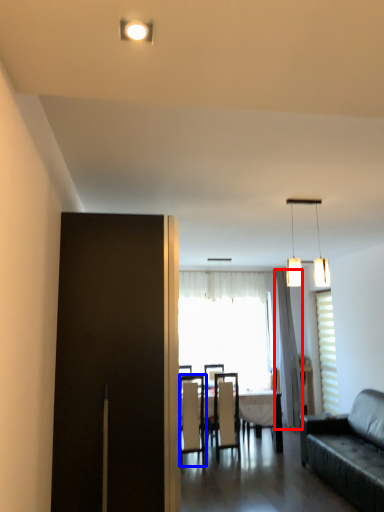
Question: Which object appears closest to the camera in this image, curtain (highlighted by a red box) or chair (highlighted by a blue box)?

Choices:
 (A) curtain
 (B) chair

Answer: (B)